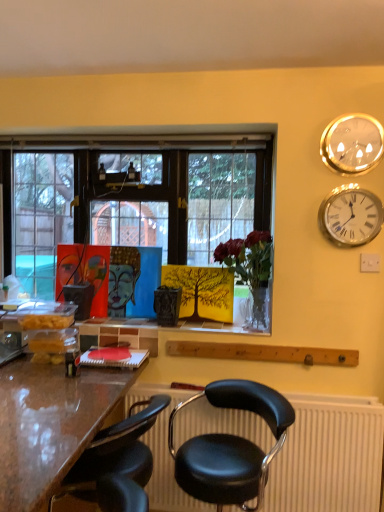
Question: Which direction should I rotate to look at black leather chair at center, the first chair when ordered from right to left?

Choices:
 (A) left
 (B) right

Answer: (B)

Question: From the image's perspective, does black plastic radiator at lower center appear higher than translucent glass vase at center?

Choices:
 (A) yes
 (B) no

Answer: (B)

Question: Would you say black plastic radiator at lower center is outside translucent glass vase at center?

Choices:
 (A) no
 (B) yes

Answer: (B)

Question: Considering the relative positions of black plastic radiator at lower center and translucent glass vase at center in the image provided, is black plastic radiator at lower center to the left of translucent glass vase at center from the viewer's perspective?

Choices:
 (A) no
 (B) yes

Answer: (A)

Question: From the image's perspective, is black plastic radiator at lower center located beneath translucent glass vase at center?

Choices:
 (A) yes
 (B) no

Answer: (A)

Question: Is black plastic radiator at lower center positioned with its back to translucent glass vase at center?

Choices:
 (A) yes
 (B) no

Answer: (B)

Question: Does black plastic radiator at lower center have a larger size compared to translucent glass vase at center?

Choices:
 (A) no
 (B) yes

Answer: (B)

Question: Does black leather chair at lower center, the first chair when ordered from left to right, come in front of black leather chair at center, marked as the second chair in a left-to-right arrangement?

Choices:
 (A) no
 (B) yes

Answer: (A)

Question: Could black leather chair at center, marked as the second chair in a left-to-right arrangement, be considered to be inside black leather chair at lower center, the first chair when ordered from left to right?

Choices:
 (A) yes
 (B) no

Answer: (B)

Question: Considering the relative sizes of black leather chair at lower center, the first chair when ordered from left to right, and black leather chair at center, marked as the second chair in a left-to-right arrangement, in the image provided, is black leather chair at lower center, the first chair when ordered from left to right, thinner than black leather chair at center, marked as the second chair in a left-to-right arrangement,?

Choices:
 (A) yes
 (B) no

Answer: (A)

Question: Can you confirm if black leather chair at lower center, arranged as the second chair when viewed from the right, is smaller than black leather chair at center, marked as the second chair in a left-to-right arrangement?

Choices:
 (A) no
 (B) yes

Answer: (B)

Question: Considering the relative sizes of black leather chair at lower center, the first chair when ordered from left to right, and black leather chair at center, marked as the second chair in a left-to-right arrangement, in the image provided, is black leather chair at lower center, the first chair when ordered from left to right, bigger than black leather chair at center, marked as the second chair in a left-to-right arrangement,?

Choices:
 (A) no
 (B) yes

Answer: (A)

Question: Is the position of black leather chair at lower center, arranged as the second chair when viewed from the right, more distant than that of black leather chair at center, the first chair when ordered from right to left?

Choices:
 (A) no
 (B) yes

Answer: (B)

Question: Is the depth of silver metallic clock at upper right, which is the 1th wall clock from bottom to top, greater than that of translucent glass vase at center?

Choices:
 (A) yes
 (B) no

Answer: (B)